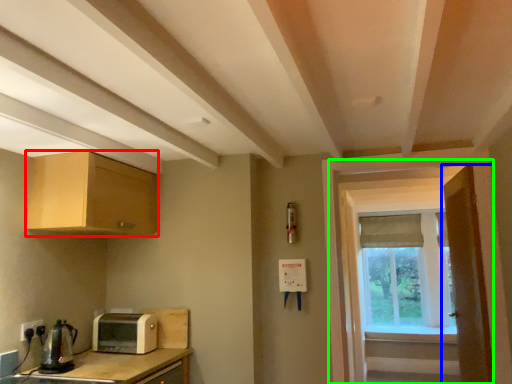
Question: Based on their relative distances, which object is farther from cabinetry (highlighted by a red box)? Choose from door (highlighted by a blue box) and screen door (highlighted by a green box).

Choices:
 (A) door
 (B) screen door

Answer: (A)